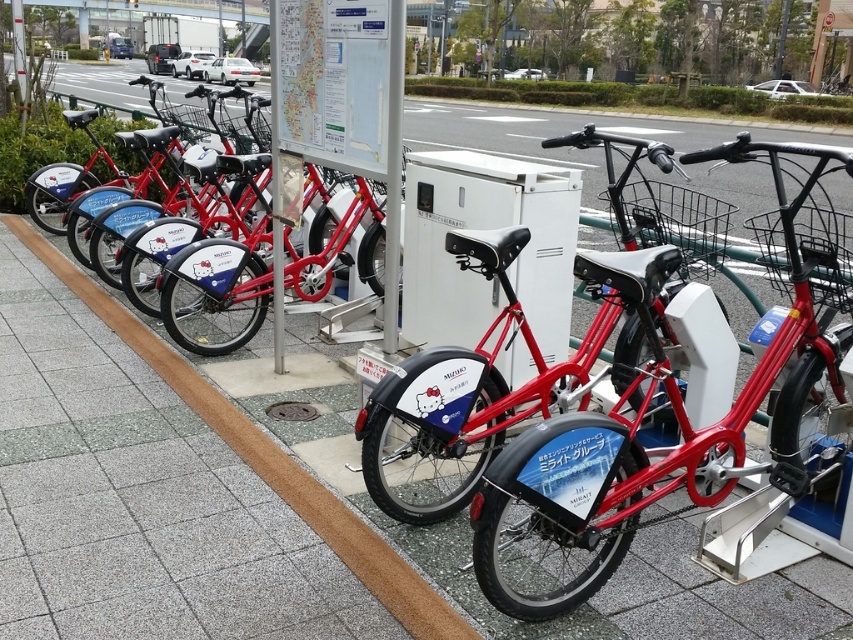
Question: Which of the following is the farthest from the observer?

Choices:
 (A) (120, 125)
 (B) (321, 124)
 (C) (587, 563)
 (D) (136, 340)

Answer: (A)

Question: Which is farther from the metallic red bicycle at center?

Choices:
 (A) matte red bicycle at center
 (B) matte black bicycle at center
 (C) white paper at upper center

Answer: (B)

Question: Where is metallic red bicycle at center located in relation to white paper at upper center in the image?

Choices:
 (A) right
 (B) left

Answer: (A)

Question: Which of the following is the farthest from the observer?

Choices:
 (A) matte black bicycle at center
 (B) white paper at upper center
 (C) matte red bicycle at center

Answer: (A)

Question: Is matte red bicycle at center positioned at the back of gray concrete curb at center?

Choices:
 (A) yes
 (B) no

Answer: (B)

Question: Is metallic red bicycle at center smaller than gray concrete curb at center?

Choices:
 (A) no
 (B) yes

Answer: (B)